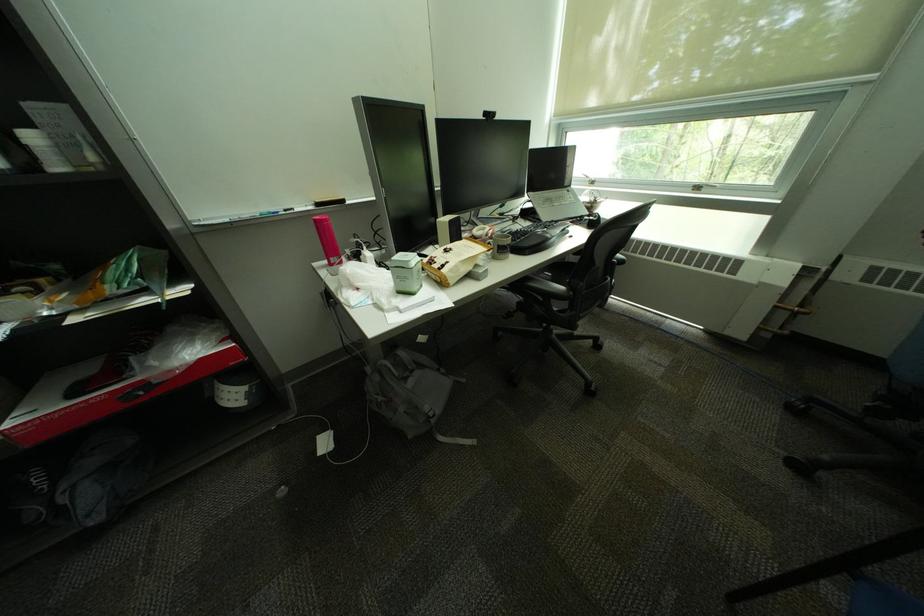
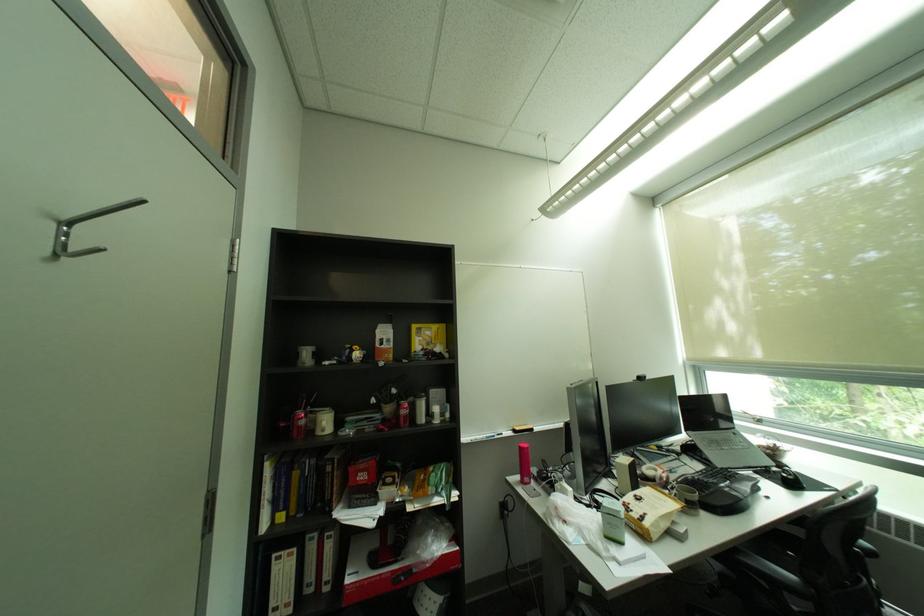
In the second image, find the point that corresponds to the point at 325,265 in the first image.

(520, 480)